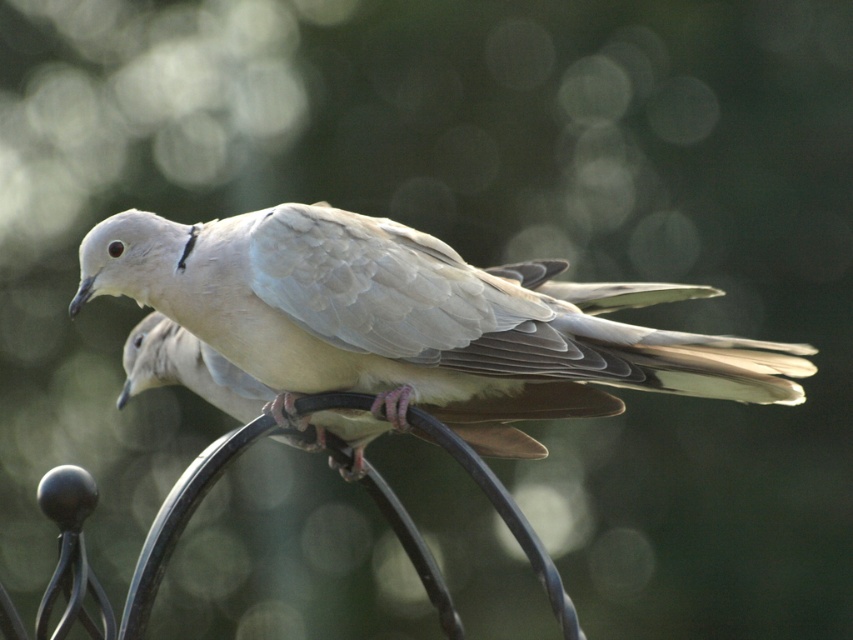
Question: Can you confirm if matte white dove at center is bigger than light gray feathered bird at center?

Choices:
 (A) no
 (B) yes

Answer: (B)

Question: Which object appears farthest from the camera in this image?

Choices:
 (A) light gray feathered bird at center
 (B) matte white dove at center

Answer: (A)

Question: Can you confirm if matte white dove at center is bigger than light gray feathered bird at center?

Choices:
 (A) yes
 (B) no

Answer: (A)

Question: Is matte white dove at center further to camera compared to light gray feathered bird at center?

Choices:
 (A) no
 (B) yes

Answer: (A)